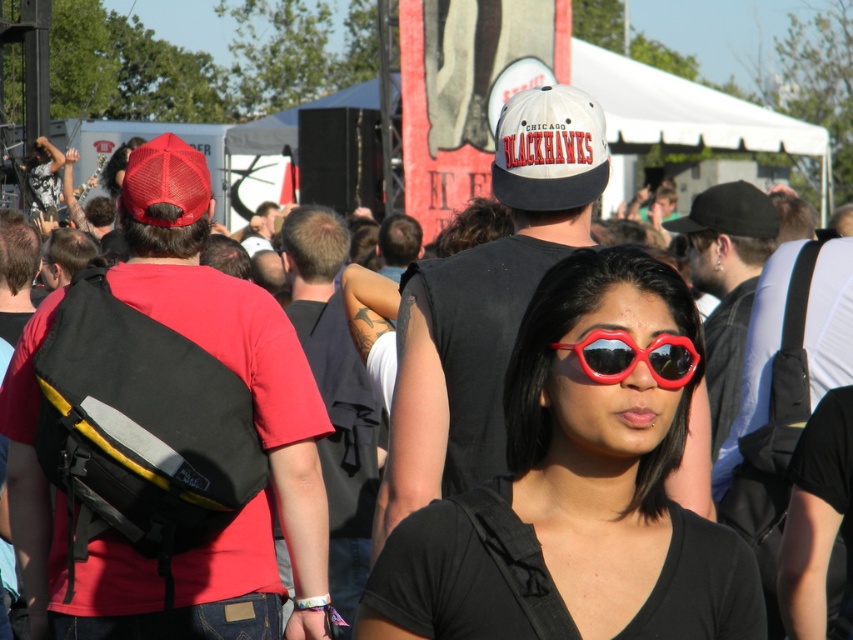
Can you confirm if shiny plastic sunglasses at center is shorter than red plastic sunglasses at center?

No.

This screenshot has width=853, height=640. What do you see at coordinates (578, 484) in the screenshot?
I see `shiny plastic sunglasses at center` at bounding box center [578, 484].

Is point (525, 552) positioned before point (695, 356)?

Yes, point (525, 552) is in front of point (695, 356).

Find the location of a particular element. shiny plastic sunglasses at center is located at coordinates (578, 484).